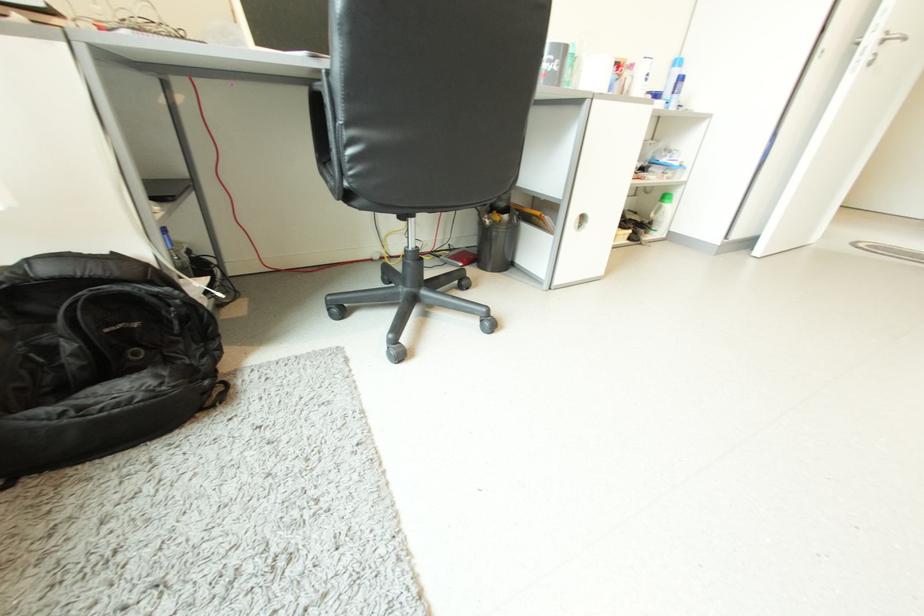
Find the location of a particular element. This screenshot has width=924, height=616. metal door handle is located at coordinates (893, 38).